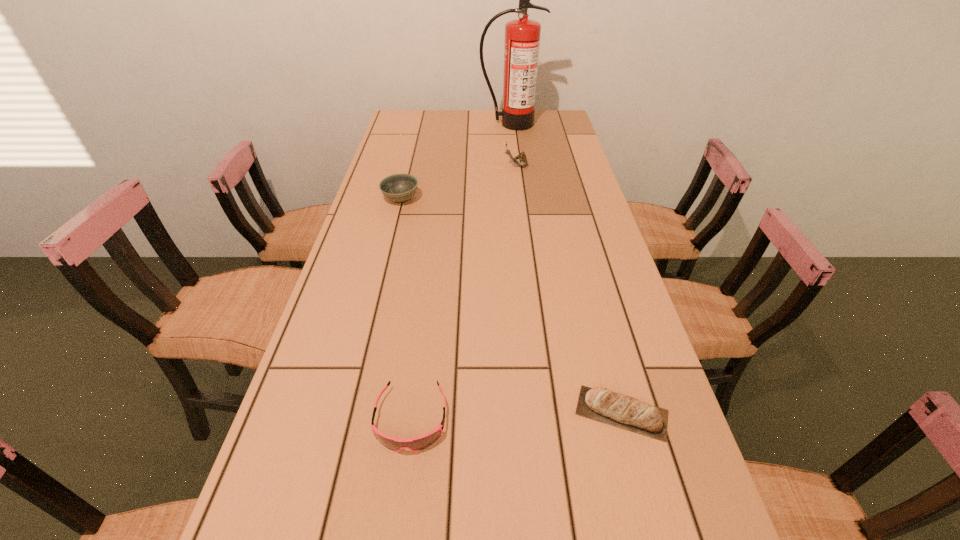
Where is `vacant region located on the face of the fourth nearest object`? The width and height of the screenshot is (960, 540). vacant region located on the face of the fourth nearest object is located at coordinates (445, 166).

Identify the location of vacant space located 0.380m on the face of the fourth nearest object. (397, 166).

You are a GUI agent. You are given a task and a screenshot of the screen. Output one action in this format:
    pyautogui.click(x=<x>, y=<y>)
    Task: Click on the vacant space located on the right of the third farthest object
    
    Given the screenshot: What is the action you would take?
    pyautogui.click(x=479, y=199)

This screenshot has width=960, height=540. What are the coordinates of `blank space located 0.100m on the front-facing side of the goggles` in the screenshot? It's located at (398, 516).

The height and width of the screenshot is (540, 960). Find the location of `free location located 0.120m on the front of the pita bread`. free location located 0.120m on the front of the pita bread is located at coordinates (648, 513).

At what (x,y) coordinates should I click in order to perform the action: click on object that is at the far edge. Please return your answer as a coordinate pair (x, y). This screenshot has width=960, height=540. Looking at the image, I should click on (522, 36).

The height and width of the screenshot is (540, 960). Identify the location of object located at the left edge. (399, 188).

Where is `fire extinguisher positioned at the right edge`? fire extinguisher positioned at the right edge is located at coordinates 522,36.

I want to click on pita bread at the right edge, so click(601, 404).

Where is `object present at the far right corner`? The width and height of the screenshot is (960, 540). object present at the far right corner is located at coordinates (522, 36).